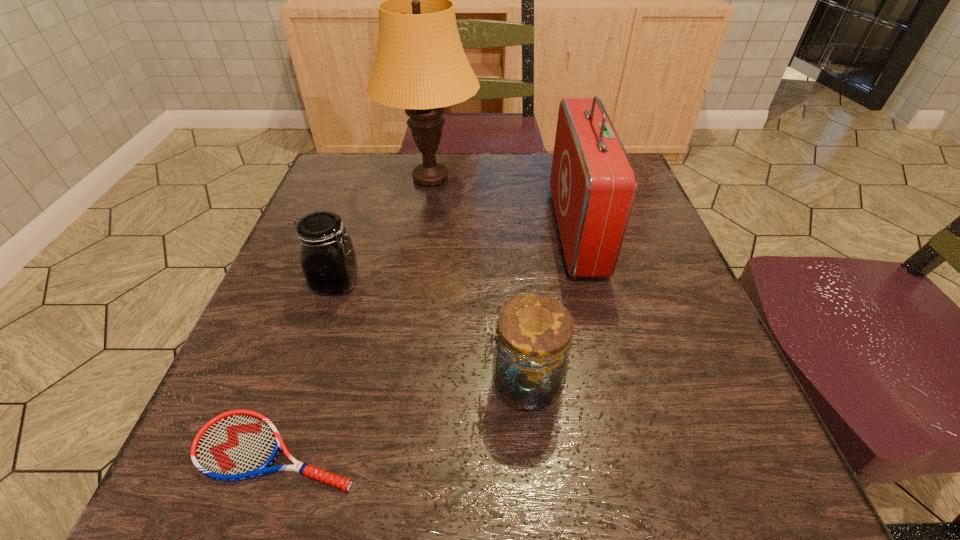
Find the location of a particular element. jar that is at the left edge is located at coordinates 327,256.

Locate an element on the screen. This screenshot has width=960, height=540. tennis racket located at the left edge is located at coordinates click(x=236, y=445).

Identify the location of object located in the right edge section of the desktop. The height and width of the screenshot is (540, 960). (593, 183).

The height and width of the screenshot is (540, 960). What are the coordinates of `object at the far left corner` in the screenshot? It's located at (420, 65).

Locate an element on the screen. Image resolution: width=960 pixels, height=540 pixels. object that is positioned at the near left corner is located at coordinates (236, 445).

Identify the location of object that is at the far right corner. (593, 183).

Locate an element on the screen. vacant space at the far edge is located at coordinates (400, 187).

This screenshot has height=540, width=960. I want to click on free space at the near edge of the desktop, so click(495, 510).

Find the location of a particular element. vacant region at the left edge of the desktop is located at coordinates (283, 327).

Where is `vacant area at the right edge`? This screenshot has width=960, height=540. vacant area at the right edge is located at coordinates (643, 240).